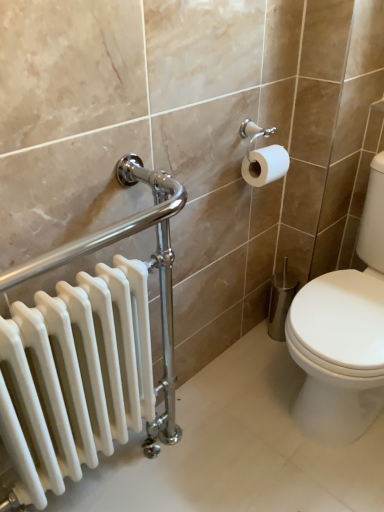
Image resolution: width=384 pixels, height=512 pixels. What are the coordinates of `white glossy radiator at left` in the screenshot? It's located at (75, 375).

You are a GUI agent. You are given a task and a screenshot of the screen. Output one action in this format:
    pyautogui.click(x=<x>, y=<y>)
    Task: Click on the white glossy radiator at left
    The image size is (384, 512).
    Given the screenshot: What is the action you would take?
    pyautogui.click(x=75, y=375)

Does white glossy toilet at right contain white glossy radiator at left?

No, white glossy toilet at right does not contain white glossy radiator at left.

Is white glossy toilet at right aimed at white glossy radiator at left?

Yes, white glossy toilet at right is turned towards white glossy radiator at left.

Is white glossy toilet at right in front of white glossy radiator at left?

No, white glossy toilet at right is further to the viewer.

Where is `radiator in front of the white glossy toilet at right`? radiator in front of the white glossy toilet at right is located at coordinates point(75,375).

Between white glossy radiator at left and white matte toilet paper at upper right, which one has smaller size?

Smaller between the two is white matte toilet paper at upper right.

Would you say white matte toilet paper at upper right is part of white glossy radiator at left's contents?

No, white matte toilet paper at upper right is not surrounded by white glossy radiator at left.

Can you confirm if white glossy radiator at left is thinner than white matte toilet paper at upper right?

Incorrect, the width of white glossy radiator at left is not less than that of white matte toilet paper at upper right.

From the picture: How different are the orientations of white glossy radiator at left and white matte toilet paper at upper right in degrees?

They differ by 0.00037 degrees in their facing directions.

Can you confirm if white matte toilet paper at upper right is thinner than white glossy radiator at left?

Indeed, white matte toilet paper at upper right has a lesser width compared to white glossy radiator at left.

From a real-world perspective, is white matte toilet paper at upper right above or below white glossy radiator at left?

From a real-world perspective, white matte toilet paper at upper right is physically above white glossy radiator at left.

From the image's perspective, between white matte toilet paper at upper right and white glossy radiator at left, who is located below?

white glossy radiator at left, from the image's perspective.

Is white glossy radiator at left surrounded by white matte toilet paper at upper right?

No, white glossy radiator at left is not surrounded by white matte toilet paper at upper right.

Which of these two, white glossy radiator at left or white glossy toilet at right, is wider?

white glossy toilet at right.

Could you tell me if white glossy radiator at left is facing white glossy toilet at right?

No, white glossy radiator at left is not oriented towards white glossy toilet at right.

Can you tell me how much white glossy radiator at left and white glossy toilet at right differ in facing direction?

90 degrees.

Considering the relative sizes of white glossy radiator at left and white glossy toilet at right in the image provided, is white glossy radiator at left bigger than white glossy toilet at right?

Incorrect, white glossy radiator at left is not larger than white glossy toilet at right.

From a real-world perspective, which object rests below the other?

white glossy toilet at right.

Which object is closer to the camera taking this photo, white matte toilet paper at upper right or white glossy toilet at right?

white glossy toilet at right is in front.

Considering the positions of point (275, 154) and point (350, 330), is point (275, 154) closer or farther from the camera than point (350, 330)?

Point (275, 154) is farther from the camera than point (350, 330).

From the picture: Is white glossy toilet at right turned away from white matte toilet paper at upper right?

white glossy toilet at right does not have its back to white matte toilet paper at upper right.

Between white glossy toilet at right and white matte toilet paper at upper right, which one has less height?

white matte toilet paper at upper right is shorter.

How different are the orientations of white glossy toilet at right and white matte toilet paper at upper right in degrees?

90 degrees.

Where is `radiator to the left of white glossy toilet at right`? radiator to the left of white glossy toilet at right is located at coordinates click(x=75, y=375).

Find the location of a particular element. radiator in front of the white matte toilet paper at upper right is located at coordinates (75, 375).

Looking at the image, which one is located closer to white matte toilet paper at upper right, white glossy toilet at right or white glossy radiator at left?

The object closer to white matte toilet paper at upper right is white glossy toilet at right.

Considering their positions, is white glossy toilet at right positioned further to white glossy radiator at left than white matte toilet paper at upper right?

white matte toilet paper at upper right.

Considering their positions, is white matte toilet paper at upper right positioned closer to white glossy radiator at left than white glossy toilet at right?

The object closer to white glossy radiator at left is white glossy toilet at right.

From the image, which object appears to be farther from white matte toilet paper at upper right, white glossy radiator at left or white glossy toilet at right?

white glossy radiator at left is positioned further to the anchor white matte toilet paper at upper right.

When comparing their distances from white glossy toilet at right, does white glossy radiator at left or white matte toilet paper at upper right seem further?

white glossy radiator at left lies further to white glossy toilet at right than the other object.

Which object lies nearer to the anchor point white glossy toilet at right, white matte toilet paper at upper right or white glossy radiator at left?

Among the two, white matte toilet paper at upper right is located nearer to white glossy toilet at right.

The width and height of the screenshot is (384, 512). I want to click on toilet paper located between white glossy radiator at left and white glossy toilet at right in the left-right direction, so click(x=266, y=164).